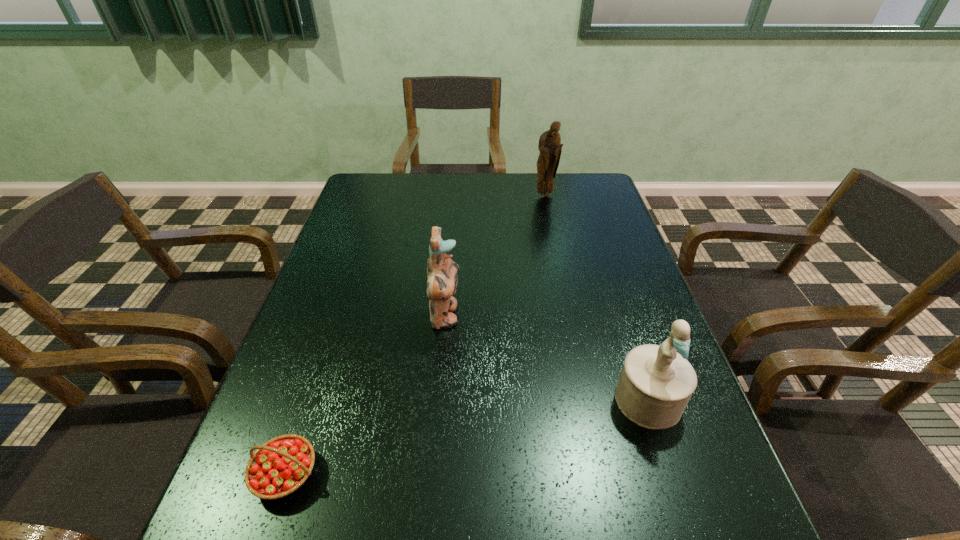
Identify which object is the third nearest to the strawberry. Please provide its 2D coordinates. Your answer should be formatted as a tuple, i.e. [(x, y)], where the tuple contains the x and y coordinates of a point satisfying the conditions above.

[(550, 147)]

The height and width of the screenshot is (540, 960). Identify the location of the second closest object to the strawberry. click(656, 383).

Find the location of a particular element. This screenshot has width=960, height=540. the second closest figurine to the second figurine from right to left is located at coordinates (656, 383).

Identify which figurine is the second nearest to the second nearest figurine. Please provide its 2D coordinates. Your answer should be formatted as a tuple, i.e. [(x, y)], where the tuple contains the x and y coordinates of a point satisfying the conditions above.

[(550, 147)]

The height and width of the screenshot is (540, 960). In order to click on blank space that satisfies the following two spatial constraints: 1. on the front-facing side of the farthest object; 2. on the front-facing side of the second nearest figurine in this screenshot , I will do `click(571, 316)`.

The width and height of the screenshot is (960, 540). Identify the location of vacant space that satisfies the following two spatial constraints: 1. on the front-facing side of the second figurine from left to right; 2. on the front-facing side of the second farthest object. (571, 316).

In order to click on free space that satisfies the following two spatial constraints: 1. on the front-facing side of the farthest figurine; 2. on the front-facing side of the second farthest object in this screenshot , I will do `click(571, 316)`.

Where is `free space that satisfies the following two spatial constraints: 1. on the front-facing side of the second figurine from left to right; 2. on the front-facing side of the second farthest figurine`? Image resolution: width=960 pixels, height=540 pixels. free space that satisfies the following two spatial constraints: 1. on the front-facing side of the second figurine from left to right; 2. on the front-facing side of the second farthest figurine is located at coordinates (571, 316).

Where is `blank area in the image that satisfies the following two spatial constraints: 1. on the front-facing side of the farthest figurine; 2. on the front-facing side of the second nearest figurine`? The width and height of the screenshot is (960, 540). blank area in the image that satisfies the following two spatial constraints: 1. on the front-facing side of the farthest figurine; 2. on the front-facing side of the second nearest figurine is located at coordinates (571, 316).